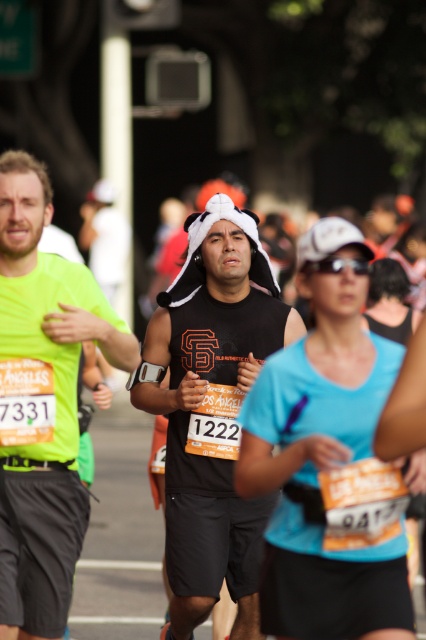
Question: Does matte black tank top at center have a smaller size compared to black matte tank top at center?

Choices:
 (A) yes
 (B) no

Answer: (A)

Question: Which point appears closest to the camera in this image?

Choices:
 (A) (52, 324)
 (B) (169, 320)

Answer: (A)

Question: Estimate the real-world distances between objects in this image. Which object is farther from the neon green fabric shirt at left?

Choices:
 (A) matte black tank top at center
 (B) black matte tank top at center

Answer: (A)

Question: Is matte black tank top at center wider than black matte tank top at center?

Choices:
 (A) yes
 (B) no

Answer: (B)

Question: Can you confirm if black matte tank top at center is positioned above neon green fabric shirt at left?

Choices:
 (A) no
 (B) yes

Answer: (A)

Question: Which of the following is the farthest from the observer?

Choices:
 (A) (276, 435)
 (B) (204, 282)

Answer: (B)